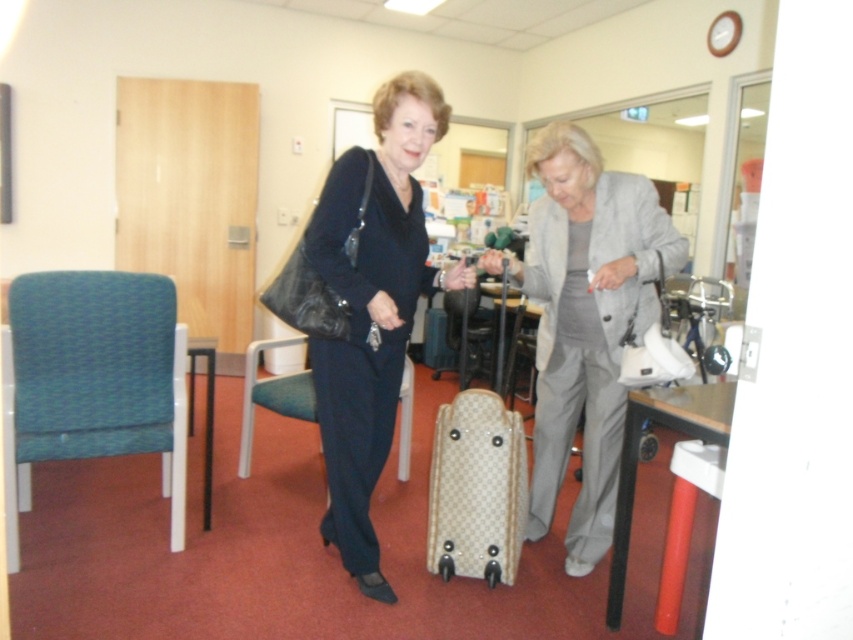
Question: Which point is closer to the camera taking this photo?

Choices:
 (A) (306, 400)
 (B) (579, 540)
 (C) (335, 372)
 (D) (141, 360)

Answer: (C)

Question: Which point appears farthest from the camera in this image?

Choices:
 (A) (456, 440)
 (B) (167, 296)
 (C) (413, 74)
 (D) (636, 230)

Answer: (B)

Question: Among these objects, which one is nearest to the camera?

Choices:
 (A) matte black dress at center
 (B) beige textured suitcase at center
 (C) blue fabric chair at center
 (D) teal fabric chair at left

Answer: (A)

Question: Is matte black dress at center below teal fabric chair at left?

Choices:
 (A) no
 (B) yes

Answer: (A)

Question: Observing the image, what is the correct spatial positioning of light gray suit at center in reference to matte black dress at center?

Choices:
 (A) above
 (B) below

Answer: (B)

Question: Is light gray suit at center further to the viewer compared to blue fabric chair at center?

Choices:
 (A) yes
 (B) no

Answer: (B)